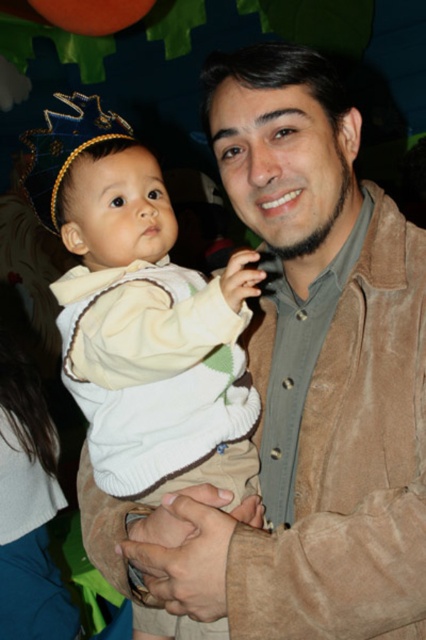
You are a photographer at a party and want to take a photo of the suede jacket at center and the blue fabric crown at upper left. Which object is located to the left of the other?

The blue fabric crown at upper left is located to the left of the suede jacket at center.

You are organizing a baby shower and need to place a white fleece sweater at center and a blue fabric crown at upper left on a table. The table has limited space. Which item takes up more space?

The white fleece sweater at center is bigger than the blue fabric crown at upper left, so it takes up more space on the table.